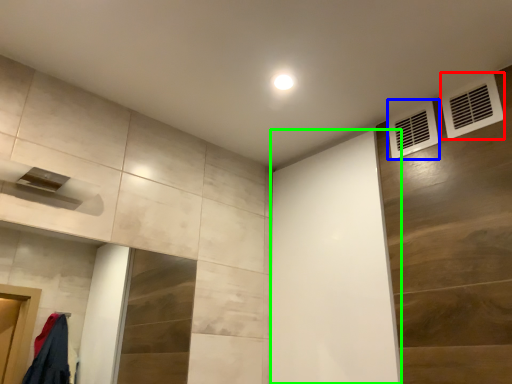
Question: Estimate the real-world distances between objects in this image. Which object is closer to air conditioning (highlighted by a red box), air conditioning (highlighted by a blue box) or screen door (highlighted by a green box)?

Choices:
 (A) air conditioning
 (B) screen door

Answer: (A)